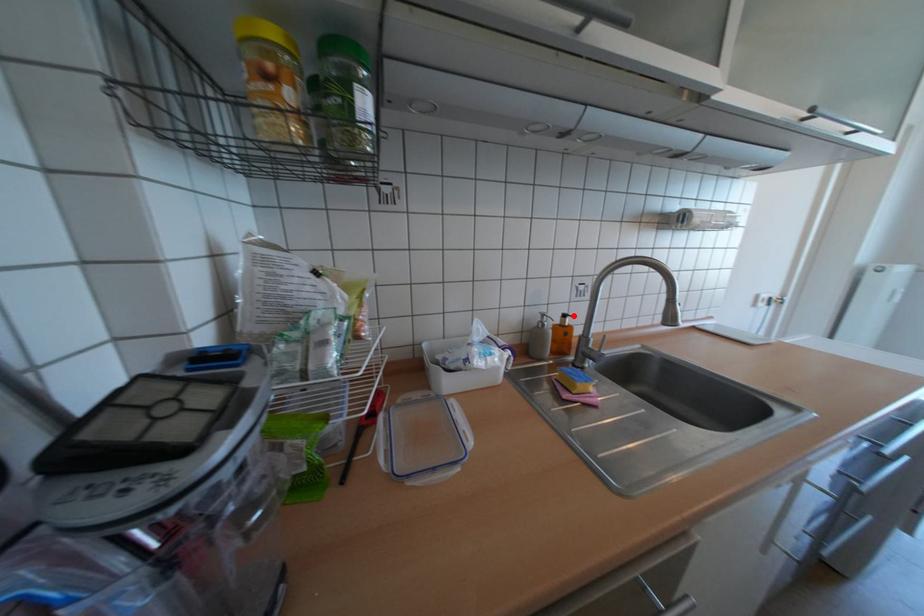
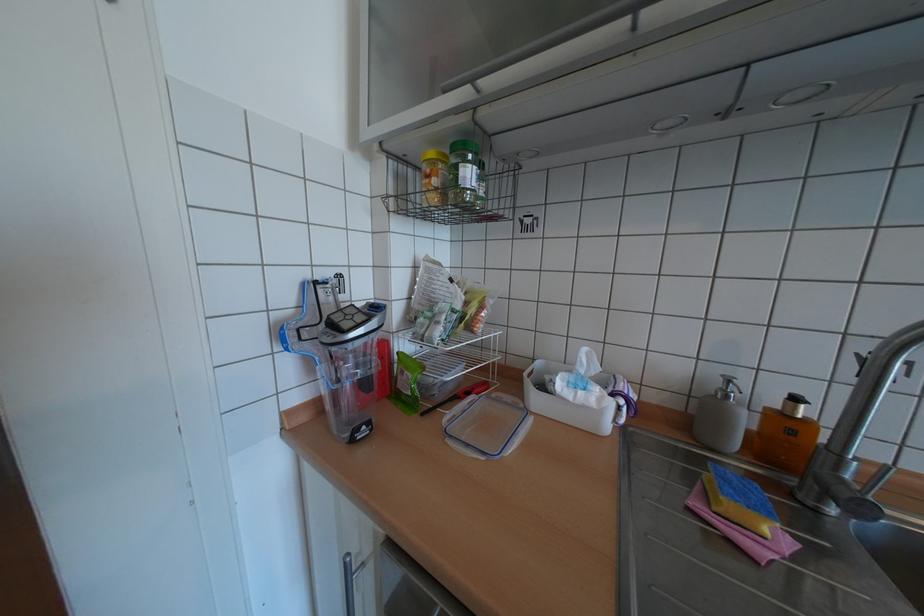
Find the pixel in the second image that matches the highlighted location in the first image.

(805, 399)